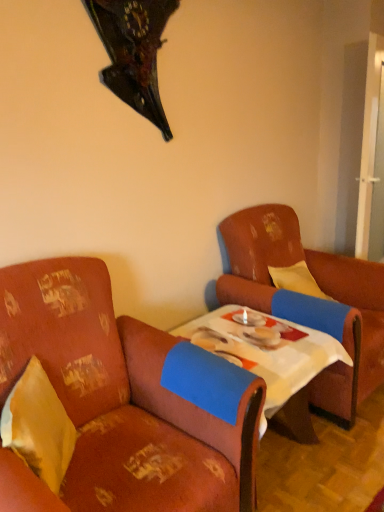
Identify the location of floral fabric armchair at left, placed as the first chair when sorted from left to right. (124, 401).

In order to face floral fabric armchair at left, the 2th chair positioned from the right, should I rotate leftwards or rightwards?

Rotate left and turn 13.060 degrees.

What do you see at coordinates (311, 301) in the screenshot? Image resolution: width=384 pixels, height=512 pixels. I see `leather armchair at right, acting as the first chair starting from the right` at bounding box center [311, 301].

Identify the location of yellow fabric pillow at left. The image size is (384, 512). (38, 426).

Is yellow fabric pillow at left situated inside leather armchair at right, acting as the first chair starting from the right, or outside?

yellow fabric pillow at left is not inside leather armchair at right, acting as the first chair starting from the right, it's outside.

From a real-world perspective, between yellow fabric pillow at left and leather armchair at right, acting as the second chair starting from the left, who is vertically higher?

From a 3D spatial view, yellow fabric pillow at left is above.

Looking at their sizes, would you say yellow fabric pillow at left is wider or thinner than leather armchair at right, acting as the second chair starting from the left?

Considering their sizes, yellow fabric pillow at left looks slimmer than leather armchair at right, acting as the second chair starting from the left.

Are yellow fabric pillow at left and leather armchair at right, acting as the first chair starting from the right, located far from each other?

That's right, there is a large distance between yellow fabric pillow at left and leather armchair at right, acting as the first chair starting from the right.

How many degrees apart are the facing directions of white cloth-covered table at center and floral fabric armchair at left, placed as the first chair when sorted from left to right?

The angle between the facing direction of white cloth-covered table at center and the facing direction of floral fabric armchair at left, placed as the first chair when sorted from left to right, is 2.26 degrees.

Can you confirm if white cloth-covered table at center is wider than floral fabric armchair at left, placed as the first chair when sorted from left to right?

In fact, white cloth-covered table at center might be narrower than floral fabric armchair at left, placed as the first chair when sorted from left to right.

Considering the relative sizes of white cloth-covered table at center and floral fabric armchair at left, the 2th chair positioned from the right, in the image provided, is white cloth-covered table at center smaller than floral fabric armchair at left, the 2th chair positioned from the right,?

Correct, white cloth-covered table at center occupies less space than floral fabric armchair at left, the 2th chair positioned from the right.

Is point (231, 349) positioned before point (22, 509)?

That is False.

Would you say white cloth-covered table at center is part of floral fabric armchair at left, the 2th chair positioned from the right,'s contents?

No, white cloth-covered table at center is not inside floral fabric armchair at left, the 2th chair positioned from the right.

Is floral fabric armchair at left, the 2th chair positioned from the right, placed right next to white cloth-covered table at center?

No, floral fabric armchair at left, the 2th chair positioned from the right, is not beside white cloth-covered table at center.

Is point (171, 497) more distant than point (312, 374)?

No, it is not.

Locate an element on the screen. Image resolution: width=384 pixels, height=512 pixels. table located on the right of floral fabric armchair at left, placed as the first chair when sorted from left to right is located at coordinates [x=269, y=357].

Who is taller, yellow fabric pillow at left or floral fabric armchair at left, the 2th chair positioned from the right?

floral fabric armchair at left, the 2th chair positioned from the right, is taller.

Based on the photo, is yellow fabric pillow at left not inside floral fabric armchair at left, the 2th chair positioned from the right?

Actually, yellow fabric pillow at left is at least partially inside floral fabric armchair at left, the 2th chair positioned from the right.

From the picture: Is yellow fabric pillow at left aimed at floral fabric armchair at left, the 2th chair positioned from the right?

Yes, yellow fabric pillow at left is oriented towards floral fabric armchair at left, the 2th chair positioned from the right.

From the picture: Considering the positions of objects yellow fabric pillow at left and floral fabric armchair at left, placed as the first chair when sorted from left to right, in the image provided, who is more to the right, yellow fabric pillow at left or floral fabric armchair at left, placed as the first chair when sorted from left to right,?

floral fabric armchair at left, placed as the first chair when sorted from left to right, is more to the right.

Can you confirm if leather armchair at right, acting as the second chair starting from the left, is wider than floral fabric armchair at left, the 2th chair positioned from the right?

Yes, leather armchair at right, acting as the second chair starting from the left, is wider than floral fabric armchair at left, the 2th chair positioned from the right.

Considering the sizes of objects leather armchair at right, acting as the second chair starting from the left, and floral fabric armchair at left, the 2th chair positioned from the right, in the image provided, who is smaller, leather armchair at right, acting as the second chair starting from the left, or floral fabric armchair at left, the 2th chair positioned from the right,?

floral fabric armchair at left, the 2th chair positioned from the right, is smaller.

Can you confirm if leather armchair at right, acting as the second chair starting from the left, is positioned to the left of floral fabric armchair at left, the 2th chair positioned from the right?

No.

Considering the points (343, 382) and (225, 481), which point is behind, point (343, 382) or point (225, 481)?

The point (343, 382) is behind.

Where is `chair that appears above the white cloth-covered table at center (from the image's perspective)`? The height and width of the screenshot is (512, 384). chair that appears above the white cloth-covered table at center (from the image's perspective) is located at coordinates (311, 301).

Is leather armchair at right, acting as the second chair starting from the left, aimed at white cloth-covered table at center?

No.

Is point (304, 309) positioned in front of point (295, 387)?

No.

Can you confirm if white cloth-covered table at center is shorter than yellow fabric pillow at left?

Yes.

In the image, is white cloth-covered table at center positioned in front of or behind yellow fabric pillow at left?

In the image, white cloth-covered table at center appears behind yellow fabric pillow at left.

From a real-world perspective, which is physically below, white cloth-covered table at center or yellow fabric pillow at left?

In real-world perspective, white cloth-covered table at center is lower.

From the image's perspective, between white cloth-covered table at center and yellow fabric pillow at left, which one is located above?

white cloth-covered table at center is shown above in the image.

The image size is (384, 512). In order to click on pillow lying in front of the leather armchair at right, acting as the first chair starting from the right in this screenshot , I will do `click(38, 426)`.

The image size is (384, 512). I want to click on table that is above the floral fabric armchair at left, placed as the first chair when sorted from left to right (from the image's perspective), so click(x=269, y=357).

When comparing their distances from leather armchair at right, acting as the second chair starting from the left, does yellow fabric pillow at left or floral fabric armchair at left, the 2th chair positioned from the right, seem further?

The object further to leather armchair at right, acting as the second chair starting from the left, is yellow fabric pillow at left.

Based on their spatial positions, is floral fabric armchair at left, the 2th chair positioned from the right, or white cloth-covered table at center further from yellow fabric pillow at left?

white cloth-covered table at center is further to yellow fabric pillow at left.

When comparing their distances from leather armchair at right, acting as the second chair starting from the left, does floral fabric armchair at left, placed as the first chair when sorted from left to right, or yellow fabric pillow at left seem closer?

floral fabric armchair at left, placed as the first chair when sorted from left to right, lies closer to leather armchair at right, acting as the second chair starting from the left, than the other object.

Considering their positions, is leather armchair at right, acting as the first chair starting from the right, positioned further to white cloth-covered table at center than yellow fabric pillow at left?

yellow fabric pillow at left is further to white cloth-covered table at center.

When comparing their distances from yellow fabric pillow at left, does leather armchair at right, acting as the first chair starting from the right, or white cloth-covered table at center seem closer?

Based on the image, white cloth-covered table at center appears to be nearer to yellow fabric pillow at left.

Based on their spatial positions, is leather armchair at right, acting as the second chair starting from the left, or yellow fabric pillow at left closer to floral fabric armchair at left, placed as the first chair when sorted from left to right?

Based on the image, yellow fabric pillow at left appears to be nearer to floral fabric armchair at left, placed as the first chair when sorted from left to right.

From the image, which object appears to be nearer to white cloth-covered table at center, floral fabric armchair at left, the 2th chair positioned from the right, or yellow fabric pillow at left?

floral fabric armchair at left, the 2th chair positioned from the right, lies closer to white cloth-covered table at center than the other object.

From the picture: Estimate the real-world distances between objects in this image. Which object is closer to yellow fabric pillow at left, white cloth-covered table at center or floral fabric armchair at left, placed as the first chair when sorted from left to right?

Among the two, floral fabric armchair at left, placed as the first chair when sorted from left to right, is located nearer to yellow fabric pillow at left.

Locate an element on the screen. table located between yellow fabric pillow at left and leather armchair at right, acting as the second chair starting from the left, in the left-right direction is located at coordinates (269, 357).

I want to click on chair located between yellow fabric pillow at left and leather armchair at right, acting as the second chair starting from the left, in the left-right direction, so click(124, 401).

The height and width of the screenshot is (512, 384). Find the location of `table between floral fabric armchair at left, the 2th chair positioned from the right, and leather armchair at right, acting as the first chair starting from the right, from left to right`. table between floral fabric armchair at left, the 2th chair positioned from the right, and leather armchair at right, acting as the first chair starting from the right, from left to right is located at coordinates (269, 357).

Identify the location of chair situated between yellow fabric pillow at left and white cloth-covered table at center from left to right. (124, 401).